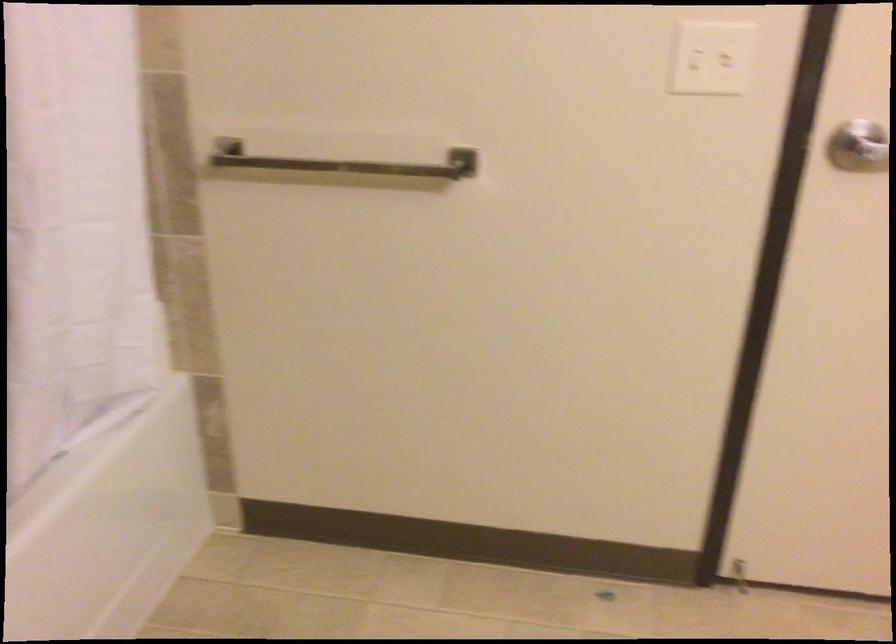
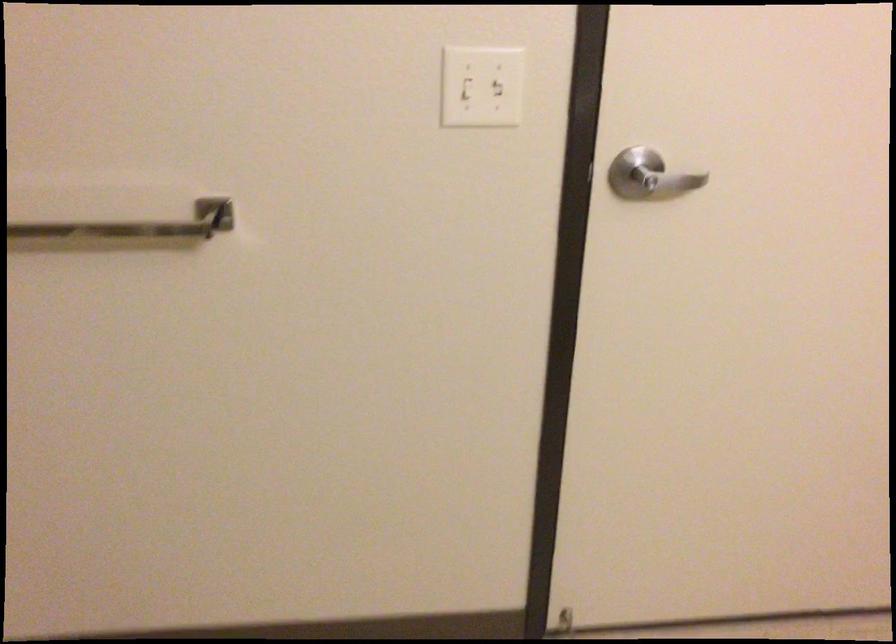
Where in the second image is the point corresponding to the point at 392,169 from the first image?

(135, 225)